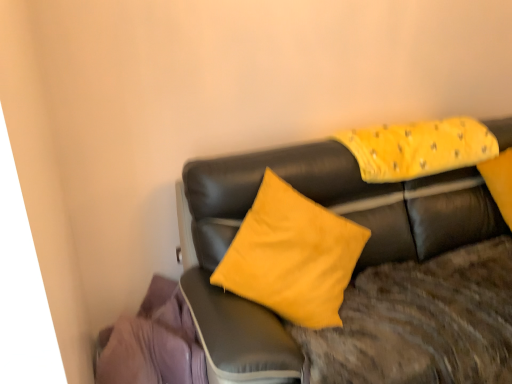
Question: Is yellow fabric pillow at upper right bigger or smaller than purple fabric at lower left?

Choices:
 (A) small
 (B) big

Answer: (A)

Question: Relative to purple fabric at lower left, is yellow fabric pillow at upper right in front or behind?

Choices:
 (A) behind
 (B) front

Answer: (A)

Question: Which object is positioned closest to the purple fabric at lower left?

Choices:
 (A) matte black couch at center
 (B) yellow fabric pillow at upper right

Answer: (A)

Question: Considering the real-world distances, which object is closest to the matte black couch at center?

Choices:
 (A) purple fabric at lower left
 (B) yellow fabric pillow at upper right

Answer: (B)